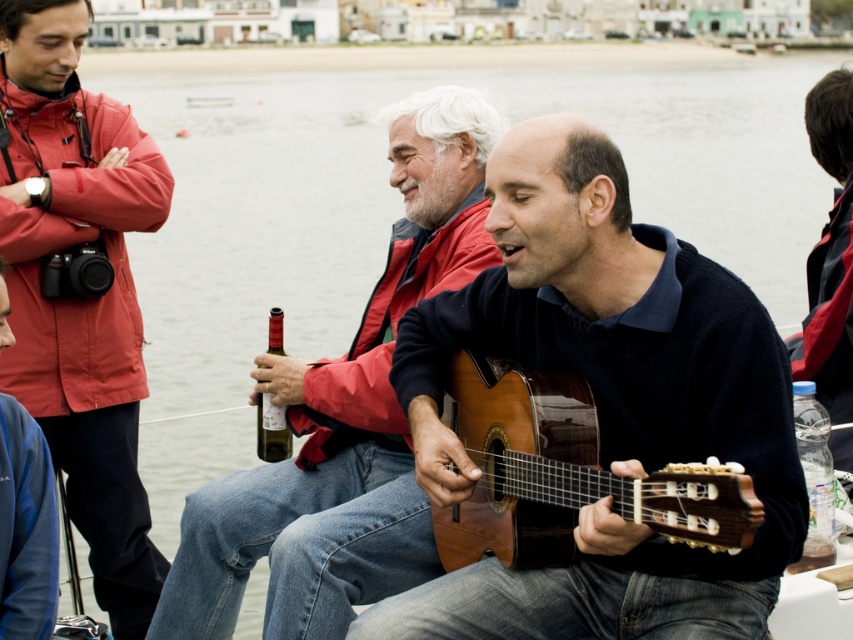
Identify the location of dark blue sweater at center. (828, 253).

Between matte brown guitar at center and green glass bottle at center, which one is positioned higher?

matte brown guitar at center is higher up.

Does point (450, 212) come behind point (273, 428)?

Yes, point (450, 212) is farther from viewer.

What do you see at coordinates (344, 419) in the screenshot? I see `matte brown guitar at center` at bounding box center [344, 419].

Locate an element on the screen. The height and width of the screenshot is (640, 853). matte brown guitar at center is located at coordinates (344, 419).

Is point (526, 632) closer to camera compared to point (45, 550)?

That is True.

Does wooden acoustic guitar at center have a smaller size compared to matte black camera at left?

Actually, wooden acoustic guitar at center might be larger than matte black camera at left.

Image resolution: width=853 pixels, height=640 pixels. Describe the element at coordinates (602, 404) in the screenshot. I see `wooden acoustic guitar at center` at that location.

Where is `wooden acoustic guitar at center`? This screenshot has width=853, height=640. wooden acoustic guitar at center is located at coordinates (602, 404).